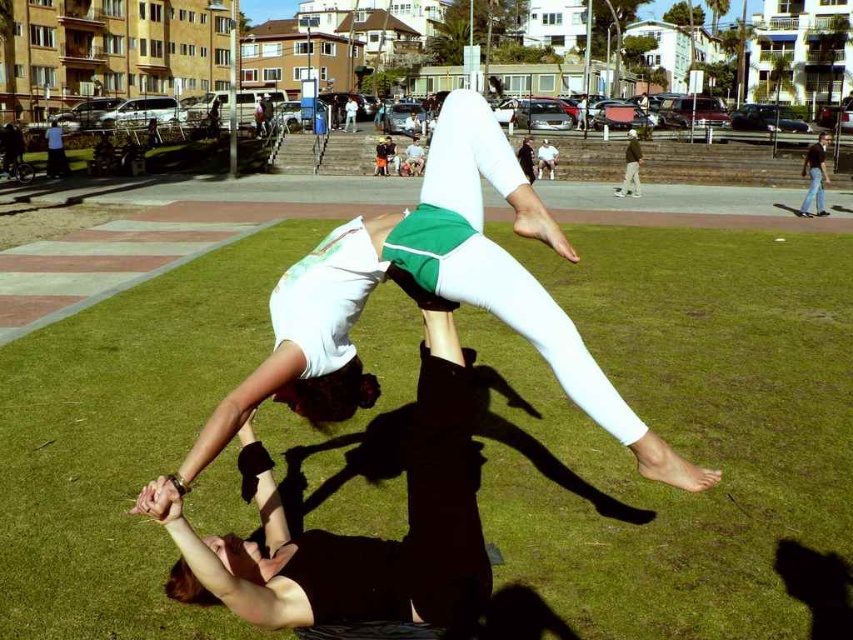
Question: Based on their relative distances, which object is farther from the light brown wooden bench at center?

Choices:
 (A) black jeans at lower right
 (B) white matte leggings at center
 (C) green grass at center

Answer: (B)

Question: Is black jeans at lower right behind light brown wooden bench at center?

Choices:
 (A) yes
 (B) no

Answer: (B)

Question: Is black jeans at lower right wider than brown cotton pants at center?

Choices:
 (A) yes
 (B) no

Answer: (A)

Question: Which point is closer to the camera taking this photo?

Choices:
 (A) (798, 442)
 (B) (602, 426)

Answer: (B)

Question: Which of these objects is positioned closest to the white matte leggings at center?

Choices:
 (A) black jeans at lower right
 (B) brown cotton pants at center
 (C) green grass at center
 (D) light brown wooden bench at center

Answer: (C)

Question: Is black jeans at lower right smaller than brown cotton pants at center?

Choices:
 (A) no
 (B) yes

Answer: (A)